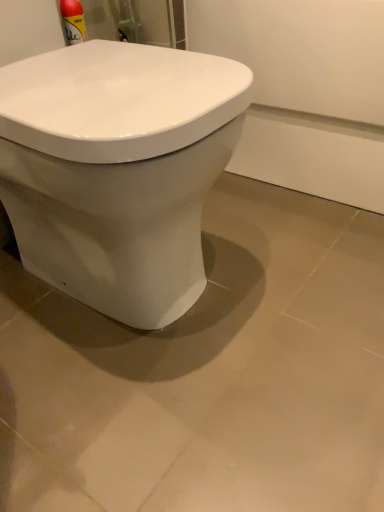
This screenshot has width=384, height=512. Find the location of `vacant area to the right of white glossy toilet at center`. vacant area to the right of white glossy toilet at center is located at coordinates (296, 267).